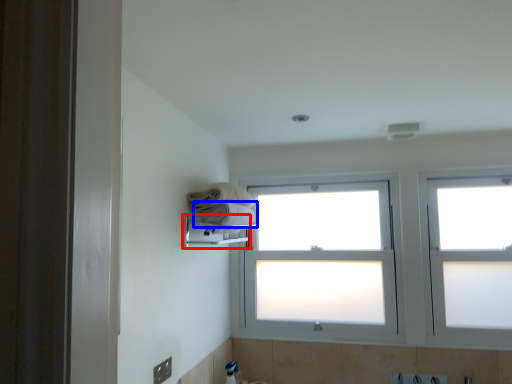
Question: Which object is closer to the camera taking this photo, towel bar (highlighted by a red box) or towel (highlighted by a blue box)?

Choices:
 (A) towel bar
 (B) towel

Answer: (A)